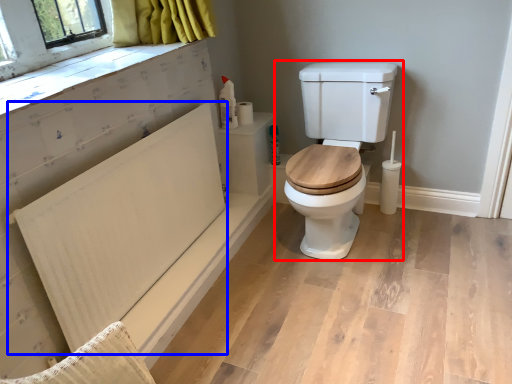
Question: Which object appears farthest to the camera in this image, toilet (highlighted by a red box) or radiator (highlighted by a blue box)?

Choices:
 (A) toilet
 (B) radiator

Answer: (A)